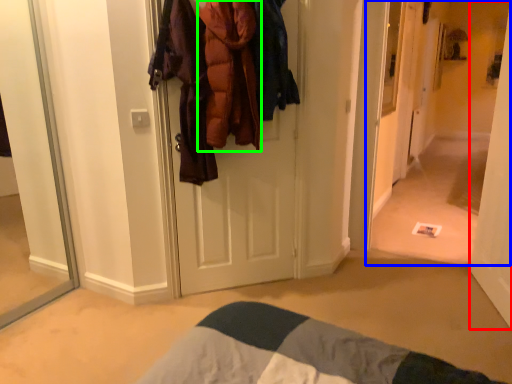
Question: Which object is the farthest from door (highlighted by a red box)? Choose among these: corridor (highlighted by a blue box) or clothing (highlighted by a green box).

Choices:
 (A) corridor
 (B) clothing

Answer: (A)